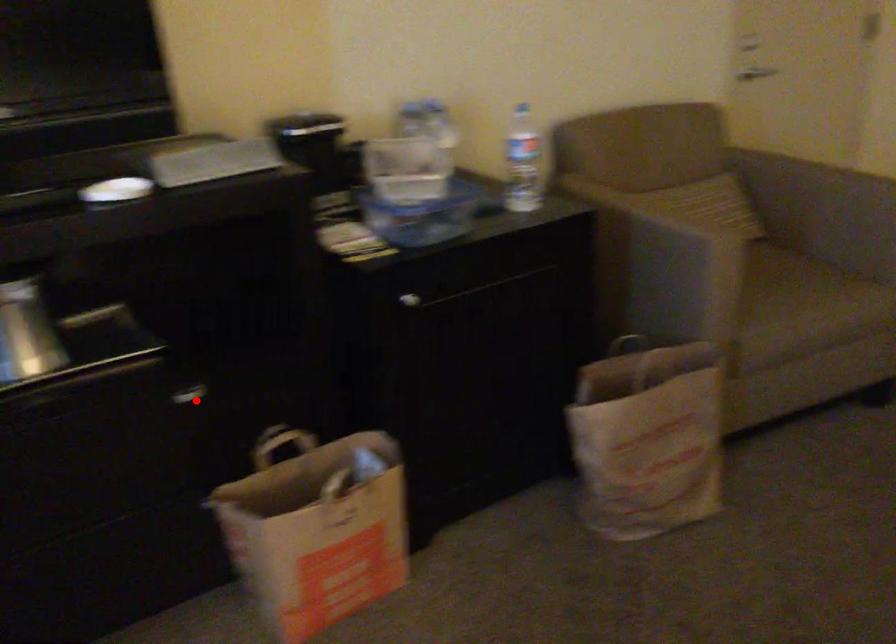
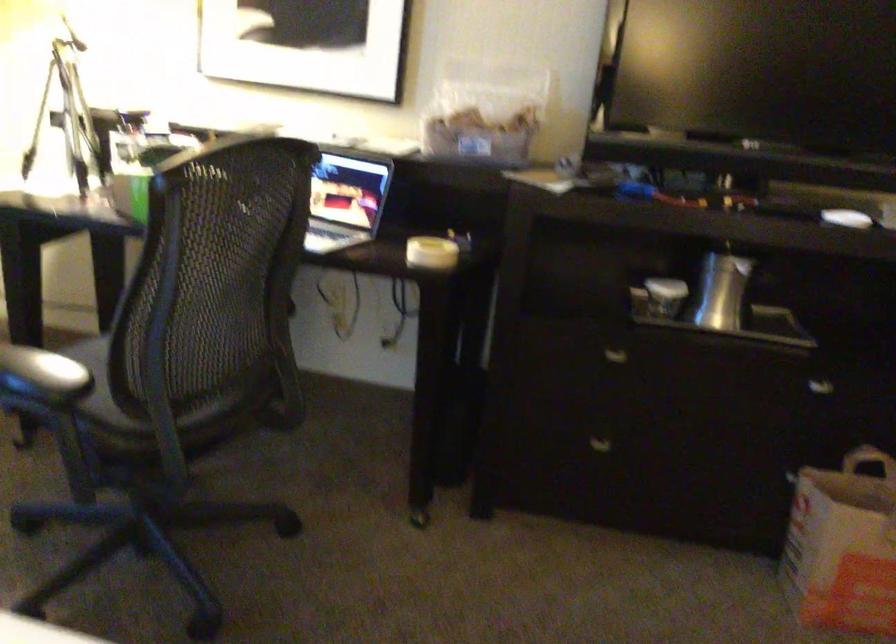
Find the pixel in the second image that matches the highlighted location in the first image.

(821, 389)